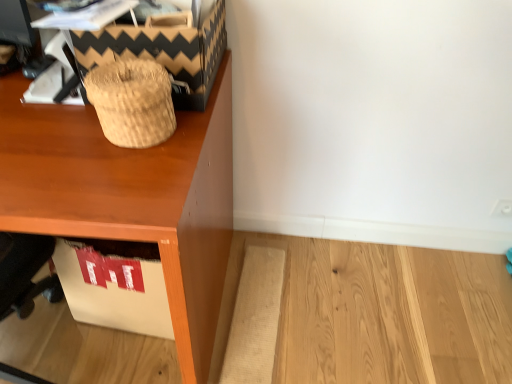
Where is `vacant area located to the right-hand side of woven straw basket at upper left`? This screenshot has height=384, width=512. vacant area located to the right-hand side of woven straw basket at upper left is located at coordinates (193, 135).